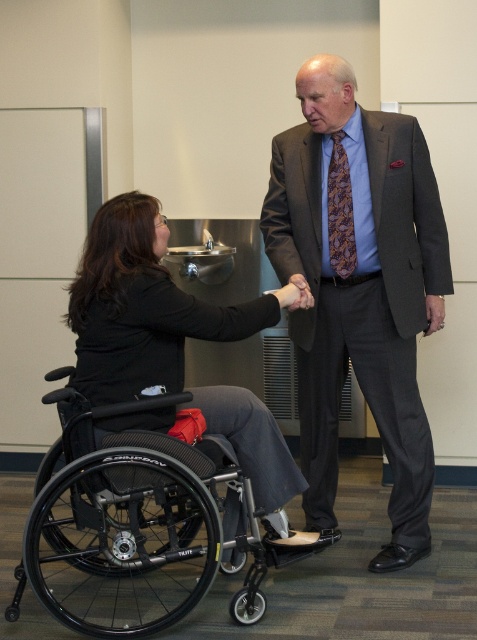
Which is behind, point (275, 198) or point (103, 428)?

The point (275, 198) is more distant.

Describe the element at coordinates (360, 296) in the screenshot. I see `dark gray suit at center` at that location.

Is point (338, 68) behind point (95, 324)?

Yes, it is.

Find the location of a particular element. dark gray suit at center is located at coordinates (360, 296).

Is dark gray suit at center above black plastic wheelchair at lower left?

Indeed, dark gray suit at center is positioned over black plastic wheelchair at lower left.

Is dark gray suit at center bigger than black plastic wheelchair at lower left?

Incorrect, dark gray suit at center is not larger than black plastic wheelchair at lower left.

Which is behind, point (372, 390) or point (227, 541)?

The point (372, 390) is more distant.

This screenshot has width=477, height=640. Find the location of `dark gray suit at center`. dark gray suit at center is located at coordinates (360, 296).

Between purple patterned tie at center and matte black hand at center, which one is positioned lower?

matte black hand at center is below.

Identify the location of purple patterned tie at center. The height and width of the screenshot is (640, 477). point(340,211).

Between point (331, 156) and point (307, 291), which one is positioned in front?

Point (307, 291) is more forward.

At what (x,y) coordinates should I click in order to perform the action: click on purple patterned tie at center. Please return your answer as a coordinate pair (x, y). This screenshot has height=640, width=477. Looking at the image, I should click on (340, 211).